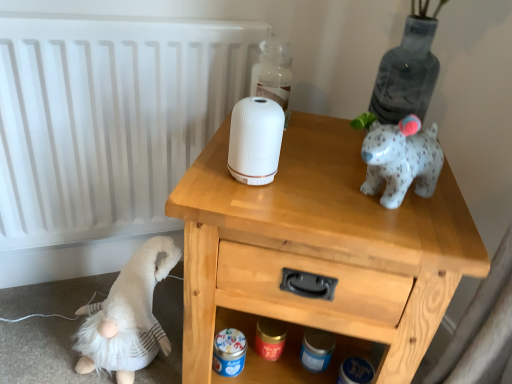
Question: Relative to transparent glass bottle at upper center, is white matte speaker at center in front or behind?

Choices:
 (A) behind
 (B) front

Answer: (B)

Question: Would you say white matte speaker at center is to the left or to the right of transparent glass bottle at upper center in the picture?

Choices:
 (A) right
 (B) left

Answer: (B)

Question: Which is farther from the white matte speaker at center?

Choices:
 (A) white fluffy gnome at lower left
 (B) white matte radiator at upper left
 (C) wooden nightstand at upper center
 (D) transparent glass bottle at upper center

Answer: (A)

Question: Estimate the real-world distances between objects in this image. Which object is farther from the white matte speaker at center?

Choices:
 (A) white fluffy gnome at lower left
 (B) white matte radiator at upper left
 (C) transparent glass bottle at upper center
 (D) wooden nightstand at upper center

Answer: (A)